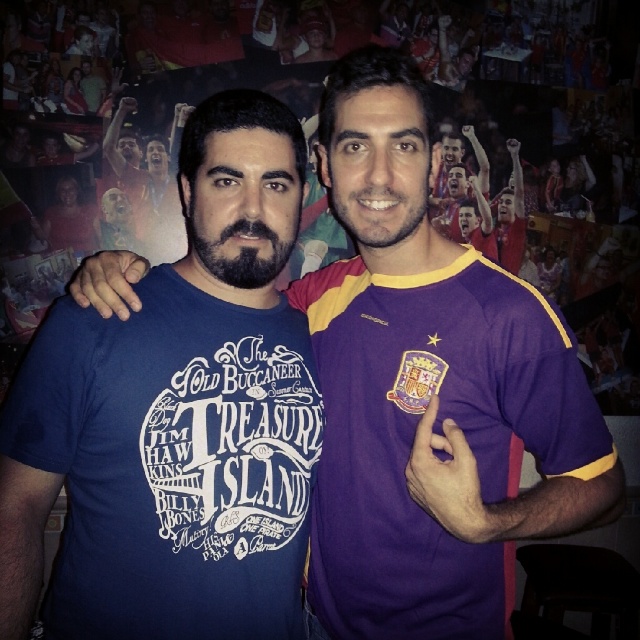
Is point (252, 236) positioned in front of point (324, 618)?

Yes.

Does blue cotton t-shirt at center lie in front of purple jersey at right?

No, blue cotton t-shirt at center is behind purple jersey at right.

The image size is (640, 640). Describe the element at coordinates (177, 417) in the screenshot. I see `blue cotton t-shirt at center` at that location.

Where is `blue cotton t-shirt at center`? blue cotton t-shirt at center is located at coordinates (177, 417).